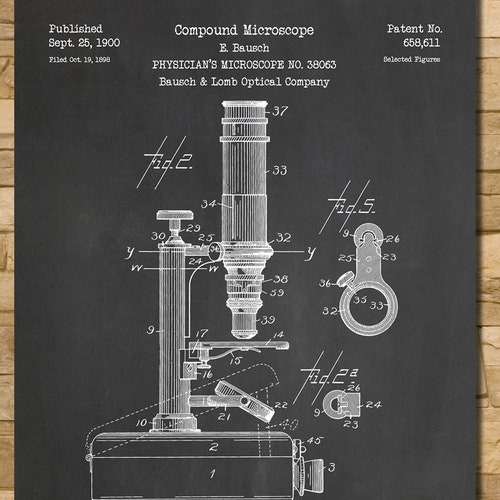
Where is `knob`? knob is located at coordinates (312, 468).